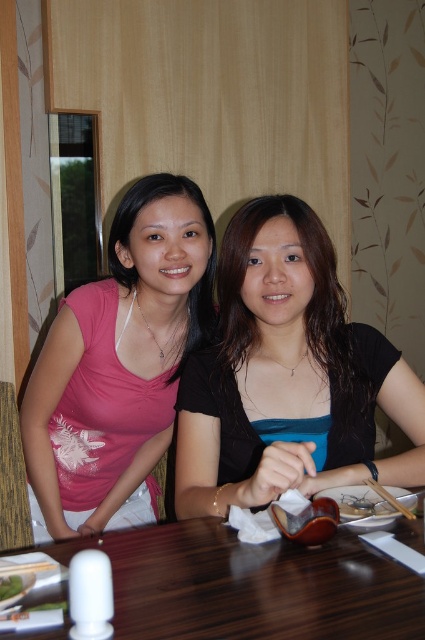
Who is taller, matte black shirt at center or wooden table at center?

Standing taller between the two is matte black shirt at center.

From the picture: Between matte black shirt at center and wooden table at center, which one is positioned lower?

wooden table at center

Identify the location of matte black shirt at center. Image resolution: width=425 pixels, height=640 pixels. (286, 372).

Is point (167, 442) in front of point (379, 493)?

No, it is not.

Is point (113, 416) positioned before point (390, 493)?

No, it is not.

Identify the location of matte pink shirt at left. Image resolution: width=425 pixels, height=640 pixels. (119, 356).

Does matte black shirt at center have a lesser width compared to green leafy vegetable at lower left?

No.

Describe the element at coordinates (286, 372) in the screenshot. I see `matte black shirt at center` at that location.

Where is `matte black shirt at center`? The image size is (425, 640). matte black shirt at center is located at coordinates (286, 372).